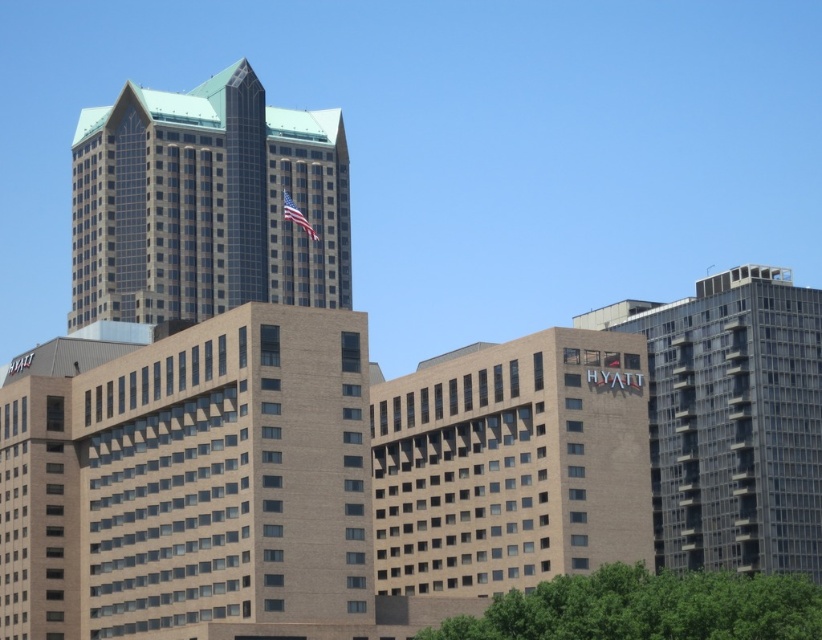
Question: Which point appears closest to the camera in this image?

Choices:
 (A) (673, 600)
 (B) (127, 269)
 (C) (650, 308)

Answer: (A)

Question: Which point appears farthest from the camera in this image?

Choices:
 (A) (539, 586)
 (B) (169, 193)
 (C) (661, 410)

Answer: (B)

Question: Which of the following is the closest to the observer?

Choices:
 (A) (816, 516)
 (B) (74, 150)

Answer: (A)

Question: Is green glass skyscraper at upper left to the right of green leafy tree at lower center from the viewer's perspective?

Choices:
 (A) yes
 (B) no

Answer: (B)

Question: Does green glass skyscraper at upper left appear under green leafy tree at lower center?

Choices:
 (A) yes
 (B) no

Answer: (B)

Question: Does green glass skyscraper at upper left have a smaller size compared to green leafy tree at lower center?

Choices:
 (A) no
 (B) yes

Answer: (A)